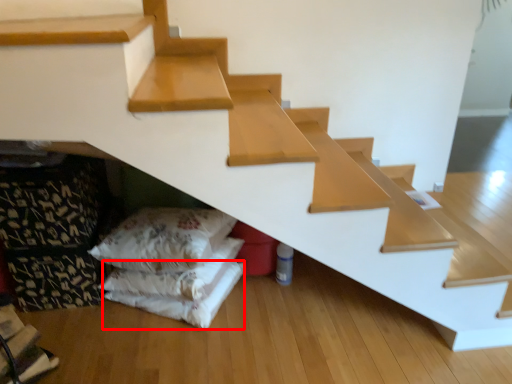
Question: Considering the relative positions of sheet (annotated by the red box) and pillow in the image provided, where is sheet (annotated by the red box) located with respect to the staircase?

Choices:
 (A) left
 (B) right

Answer: (A)